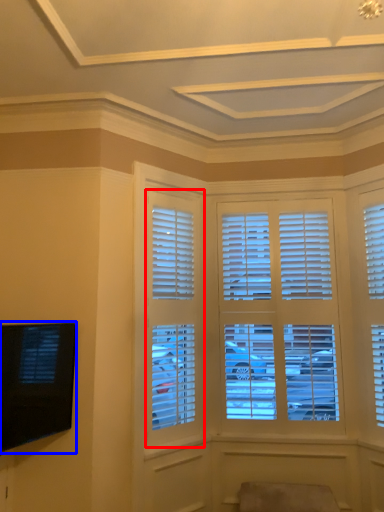
Question: Among these objects, which one is farthest to the camera, window (highlighted by a red box) or television (highlighted by a blue box)?

Choices:
 (A) window
 (B) television

Answer: (A)